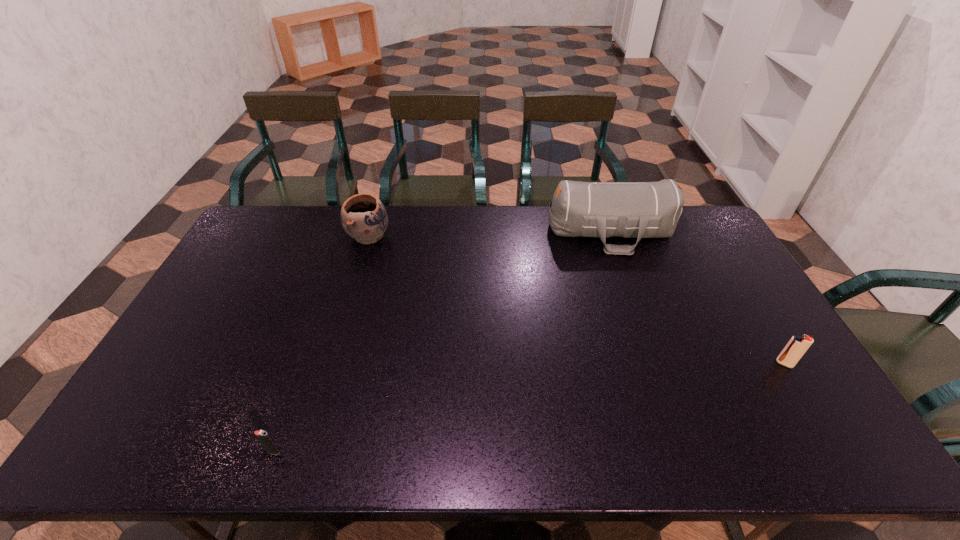
Identify the location of duffel bag. (639, 210).

Locate an element on the screen. The image size is (960, 540). the tallest object is located at coordinates (639, 210).

Where is `the third shortest object`? The width and height of the screenshot is (960, 540). the third shortest object is located at coordinates (363, 216).

I want to click on the taller igniter, so click(x=797, y=346).

I want to click on the third tallest object, so click(797, 346).

Where is `the shortest object`? This screenshot has width=960, height=540. the shortest object is located at coordinates (264, 438).

Locate an element on the screen. the shorter igniter is located at coordinates tap(264, 438).

At what (x,y) coordinates should I click in order to perform the action: click on vacant space located on the right of the tallest object. Please return your answer as a coordinate pair (x, y). Image resolution: width=960 pixels, height=540 pixels. Looking at the image, I should click on (694, 232).

Find the location of a particular element. vacant region located 0.210m on the right of the pottery is located at coordinates tap(448, 236).

You are a GUI agent. You are given a task and a screenshot of the screen. Output one action in this format:
    pyautogui.click(x=<x>, y=<y>)
    Task: Click on the vacant area situated 0.370m on the back of the taller igniter
    
    Given the screenshot: What is the action you would take?
    pyautogui.click(x=727, y=268)